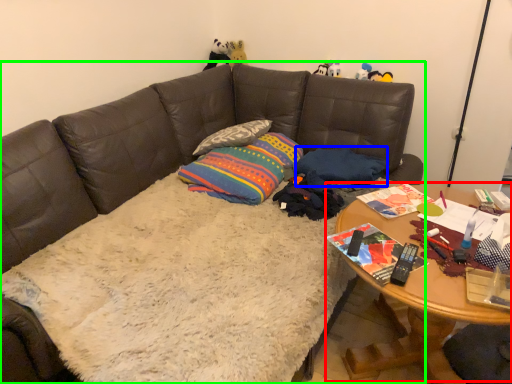
Question: Based on their relative distances, which object is nearer to table (highlighted by a red box)? Choose from pillow (highlighted by a blue box) and studio couch (highlighted by a green box).

Choices:
 (A) pillow
 (B) studio couch

Answer: (A)